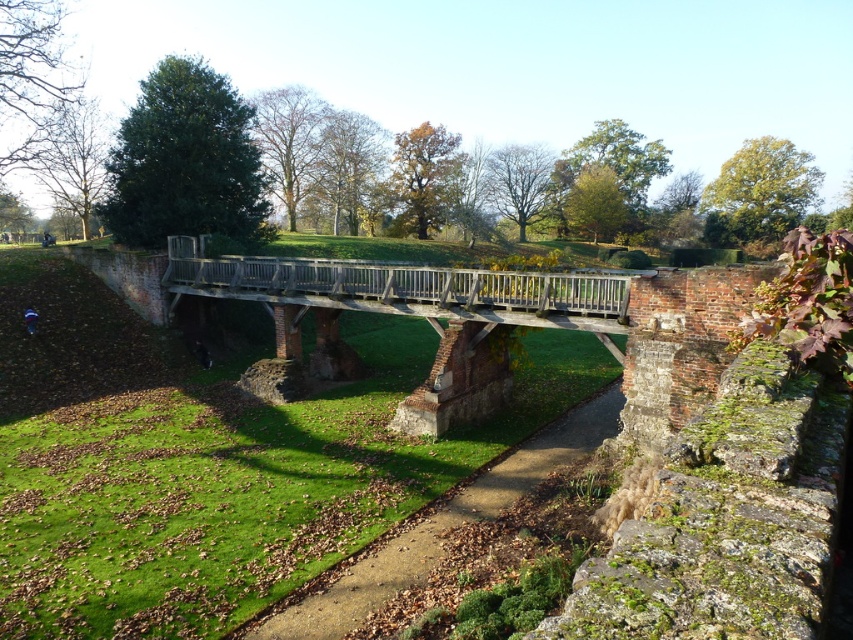
You are standing on the dirt path and want to cross to the other side of the grassy area. Is the wooden bridge at center accessible from your current position on the brown dirt path at lower center?

The wooden bridge at center is located above the brown dirt path at lower center, so yes, you can access the wooden bridge at center from the brown dirt path at lower center by walking towards it.

You are standing at point (413,314) in the scene. What object are you directly standing on?

You are directly standing on the wooden bridge at center.